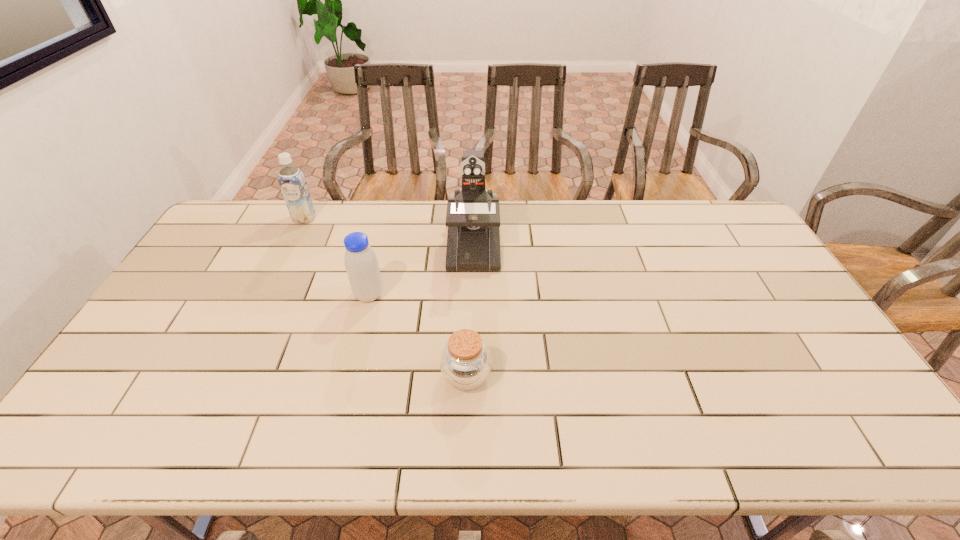
This screenshot has height=540, width=960. In order to click on free region located on the back of the nearest object in this screenshot , I will do `click(468, 308)`.

Locate an element on the screen. The height and width of the screenshot is (540, 960). microscope situated at the far edge is located at coordinates (473, 215).

The height and width of the screenshot is (540, 960). Identify the location of soya milk positioned at the far edge. (291, 179).

Image resolution: width=960 pixels, height=540 pixels. In the image, there is a desktop. Find the location of `free space at the far edge`. free space at the far edge is located at coordinates (280, 217).

The height and width of the screenshot is (540, 960). In the image, there is a desktop. Identify the location of vacant space at the near edge. (373, 439).

In the image, there is a desktop. At what (x,y) coordinates should I click in order to perform the action: click on vacant region at the left edge. Please return your answer as a coordinate pair (x, y). This screenshot has height=540, width=960. Looking at the image, I should click on (165, 384).

Identify the location of free space at the far left corner of the desktop. This screenshot has width=960, height=540. (241, 231).

Where is `vacant space that's between the microscope and the second shortest object`? vacant space that's between the microscope and the second shortest object is located at coordinates (420, 269).

Identify the location of free spot between the farther soya milk and the second object from left to right. (337, 256).

Find the location of `free space between the jar and the microscope`. free space between the jar and the microscope is located at coordinates (469, 310).